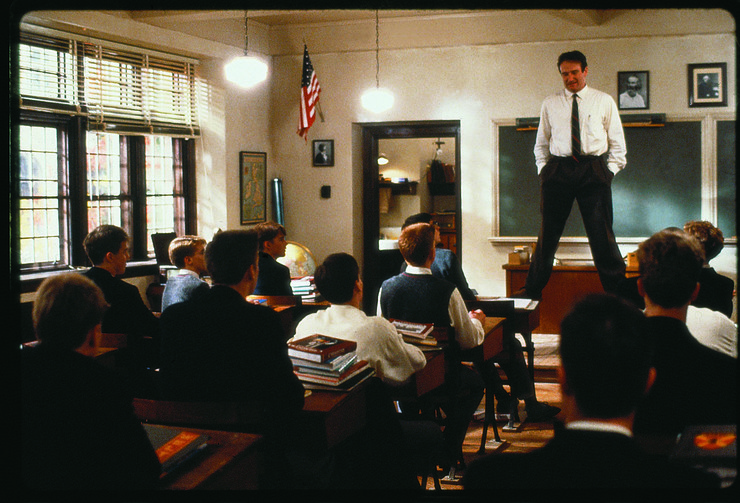
Locate an element on the screen. The image size is (740, 503). side windows is located at coordinates (37, 221), (103, 195), (149, 200).